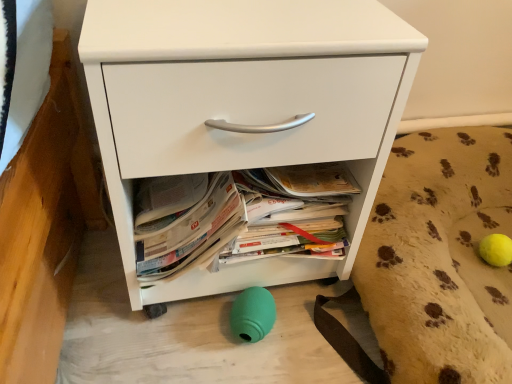
Question: Are beige textured dog bed at lower right and white matte chest of drawers at center making contact?

Choices:
 (A) yes
 (B) no

Answer: (B)

Question: Is beige textured dog bed at lower right wider than white matte chest of drawers at center?

Choices:
 (A) no
 (B) yes

Answer: (B)

Question: From the image's perspective, does beige textured dog bed at lower right appear lower than white matte chest of drawers at center?

Choices:
 (A) yes
 (B) no

Answer: (A)

Question: Can you confirm if beige textured dog bed at lower right is shorter than white matte chest of drawers at center?

Choices:
 (A) yes
 (B) no

Answer: (A)

Question: From the image's perspective, is beige textured dog bed at lower right on white matte chest of drawers at center?

Choices:
 (A) yes
 (B) no

Answer: (B)

Question: Can you confirm if beige textured dog bed at lower right is thinner than white matte chest of drawers at center?

Choices:
 (A) yes
 (B) no

Answer: (B)

Question: Can you confirm if white matte chest of drawers at center is thinner than beige textured dog bed at lower right?

Choices:
 (A) yes
 (B) no

Answer: (A)

Question: From the image's perspective, is white matte chest of drawers at center on top of beige textured dog bed at lower right?

Choices:
 (A) no
 (B) yes

Answer: (B)

Question: Can you confirm if white matte chest of drawers at center is positioned to the left of beige textured dog bed at lower right?

Choices:
 (A) no
 (B) yes

Answer: (B)

Question: Is the depth of white matte chest of drawers at center less than that of beige textured dog bed at lower right?

Choices:
 (A) yes
 (B) no

Answer: (A)

Question: Does white matte chest of drawers at center have a greater width compared to beige textured dog bed at lower right?

Choices:
 (A) yes
 (B) no

Answer: (B)

Question: Does white matte chest of drawers at center have a lesser height compared to beige textured dog bed at lower right?

Choices:
 (A) yes
 (B) no

Answer: (B)

Question: In the image, is beige textured dog bed at lower right on the left side or the right side of white matte chest of drawers at center?

Choices:
 (A) right
 (B) left

Answer: (A)